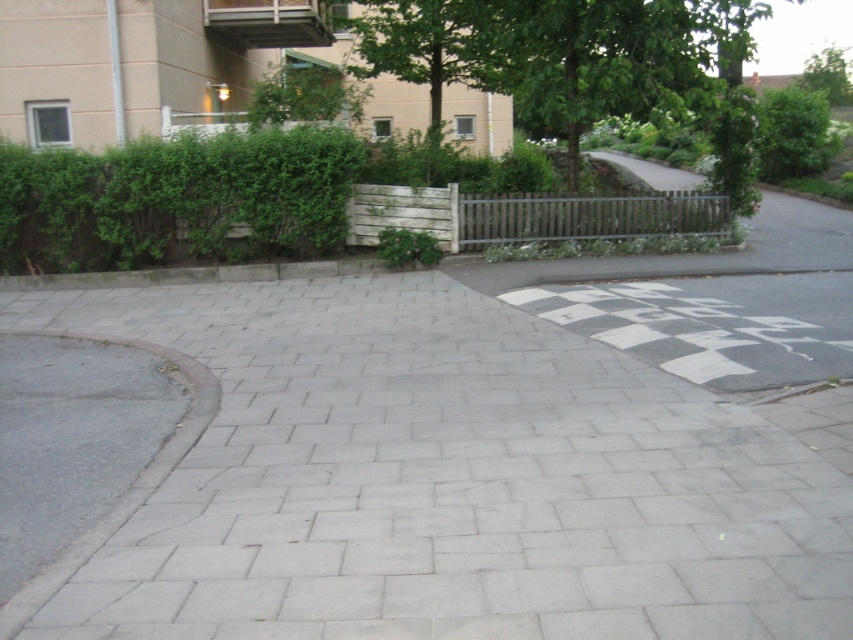
Question: Is gray concrete pavement at center above green leafy tree at upper right?

Choices:
 (A) yes
 (B) no

Answer: (B)

Question: Does gray concrete pavement at center have a lesser width compared to green leafy hedge at left?

Choices:
 (A) no
 (B) yes

Answer: (B)

Question: Which of the following is the closest to the observer?

Choices:
 (A) (254, 422)
 (B) (141, 193)
 (C) (831, 77)

Answer: (A)

Question: Estimate the real-world distances between objects in this image. Which object is farther from the gray concrete pavement at center?

Choices:
 (A) green leafy hedge at left
 (B) green leafy tree at upper right

Answer: (B)

Question: Can you confirm if green leafy hedge at left is bigger than green leafy tree at upper right?

Choices:
 (A) yes
 (B) no

Answer: (A)

Question: Which of these objects is positioned closest to the green leafy tree at upper right?

Choices:
 (A) green leafy hedge at left
 (B) gray concrete pavement at center

Answer: (A)